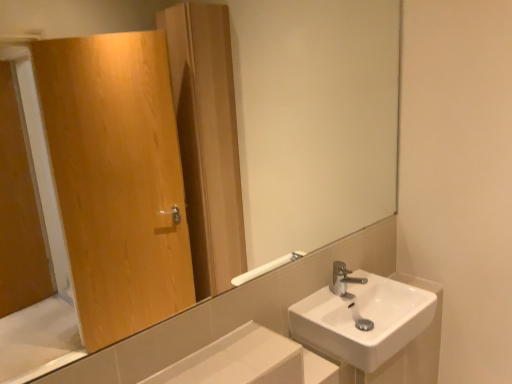
This screenshot has width=512, height=384. I want to click on white glossy sink at lower right, so click(x=376, y=328).

What do you see at coordinates (376, 328) in the screenshot? I see `white glossy sink at lower right` at bounding box center [376, 328].

Find the location of `white glossy sink at lower right`. white glossy sink at lower right is located at coordinates (376, 328).